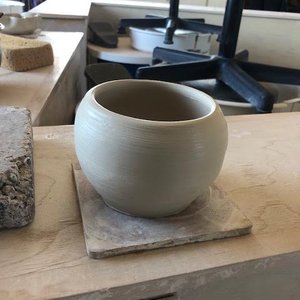
The image size is (300, 300). In order to click on chair leg in this screenshot , I will do `click(245, 77)`.